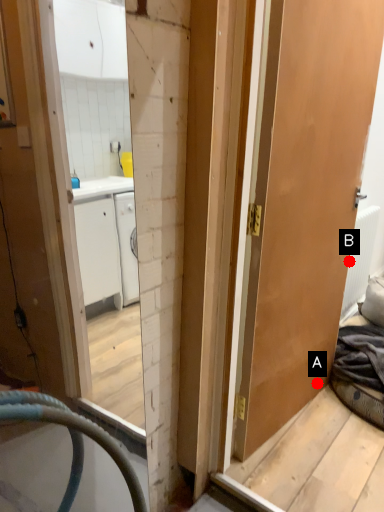
Question: Two points are circled on the image, labeled by A and B beside each circle. Which point is closer to the camera?

Choices:
 (A) A is closer
 (B) B is closer

Answer: (A)